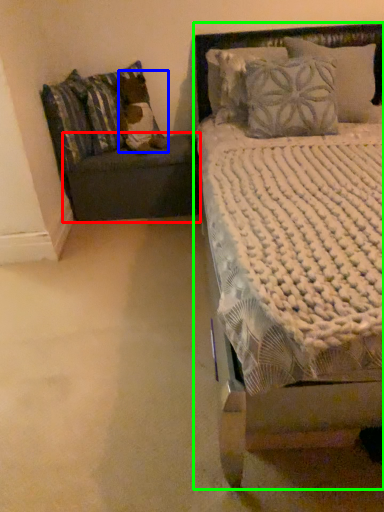
Question: Based on their relative distances, which object is nearer to table (highlighted by a red box)? Choose from pillow (highlighted by a blue box) and bed (highlighted by a green box).

Choices:
 (A) pillow
 (B) bed

Answer: (A)